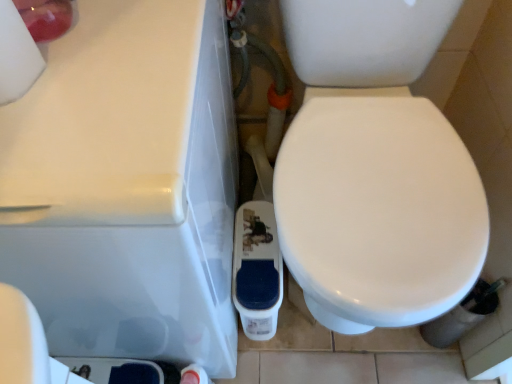
Question: From a real-world perspective, is white glossy porcelain at center physically above white matte toilet paper at upper left?

Choices:
 (A) yes
 (B) no

Answer: (B)

Question: Is white glossy porcelain at center shorter than white matte toilet paper at upper left?

Choices:
 (A) no
 (B) yes

Answer: (A)

Question: Is white glossy porcelain at center wider than white matte toilet paper at upper left?

Choices:
 (A) no
 (B) yes

Answer: (B)

Question: From the image's perspective, is white glossy porcelain at center above white matte toilet paper at upper left?

Choices:
 (A) yes
 (B) no

Answer: (B)

Question: Is white glossy porcelain at center bigger than white matte toilet paper at upper left?

Choices:
 (A) yes
 (B) no

Answer: (A)

Question: From the image's perspective, is white glossy porcelain at center located above or below white glossy bidet at center?

Choices:
 (A) below
 (B) above

Answer: (A)

Question: Is point (106, 241) closer or farther from the camera than point (302, 273)?

Choices:
 (A) closer
 (B) farther

Answer: (A)

Question: Is white glossy porcelain at center inside or outside of white glossy bidet at center?

Choices:
 (A) outside
 (B) inside

Answer: (A)

Question: Based on their sizes in the image, would you say white glossy porcelain at center is bigger or smaller than white glossy bidet at center?

Choices:
 (A) small
 (B) big

Answer: (A)

Question: From a real-world perspective, is white glossy bidet at center above or below white glossy porcelain at center?

Choices:
 (A) above
 (B) below

Answer: (B)

Question: Choose the correct answer: Is white glossy bidet at center inside white glossy porcelain at center or outside it?

Choices:
 (A) outside
 (B) inside

Answer: (A)

Question: In the image, is white glossy bidet at center on the left side or the right side of white glossy porcelain at center?

Choices:
 (A) right
 (B) left

Answer: (A)

Question: In terms of size, does white glossy bidet at center appear bigger or smaller than white glossy porcelain at center?

Choices:
 (A) small
 (B) big

Answer: (B)

Question: Is white matte toilet paper at upper left spatially inside white glossy porcelain at center, or outside of it?

Choices:
 (A) outside
 (B) inside

Answer: (A)

Question: Looking at their shapes, would you say white matte toilet paper at upper left is wider or thinner than white glossy porcelain at center?

Choices:
 (A) wide
 (B) thin

Answer: (B)